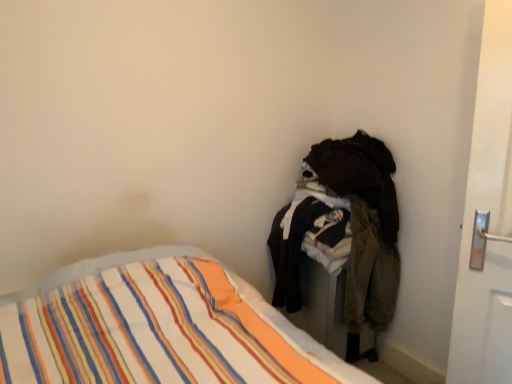
This screenshot has height=384, width=512. What are the coordinates of `striped fabric bed at lower left` in the screenshot? It's located at (300, 335).

The image size is (512, 384). What do you see at coordinates (300, 335) in the screenshot?
I see `striped fabric bed at lower left` at bounding box center [300, 335].

The height and width of the screenshot is (384, 512). I want to click on dark fabric laundry at right, so click(343, 232).

What do you see at coordinates (343, 232) in the screenshot?
I see `dark fabric laundry at right` at bounding box center [343, 232].

In order to face dark fabric laundry at right, should I rotate leftwards or rightwards?

You should rotate right by 9.569 degrees.

The width and height of the screenshot is (512, 384). Identify the location of striped fabric bed at lower left. click(300, 335).

Considering the relative positions of dark fabric laundry at right and striped fabric bed at lower left in the image provided, is dark fabric laundry at right to the left of striped fabric bed at lower left from the viewer's perspective?

No, dark fabric laundry at right is not to the left of striped fabric bed at lower left.

Considering the positions of objects dark fabric laundry at right and striped fabric bed at lower left in the image provided, who is in front, dark fabric laundry at right or striped fabric bed at lower left?

striped fabric bed at lower left.

Does point (377, 197) come closer to viewer compared to point (371, 377)?

No.

From the image's perspective, which is above, dark fabric laundry at right or striped fabric bed at lower left?

dark fabric laundry at right appears higher in the image.

From a real-world perspective, which object stands above the other?

dark fabric laundry at right is physically above.

Considering the sizes of objects dark fabric laundry at right and striped fabric bed at lower left in the image provided, who is thinner, dark fabric laundry at right or striped fabric bed at lower left?

Thinner between the two is dark fabric laundry at right.

Based on the photo, does dark fabric laundry at right have a lesser height compared to striped fabric bed at lower left?

In fact, dark fabric laundry at right may be taller than striped fabric bed at lower left.

Can you confirm if dark fabric laundry at right is smaller than striped fabric bed at lower left?

Yes, dark fabric laundry at right is smaller than striped fabric bed at lower left.

Which is correct: dark fabric laundry at right is inside striped fabric bed at lower left, or outside of it?

dark fabric laundry at right exists outside the volume of striped fabric bed at lower left.

Is dark fabric laundry at right not close to striped fabric bed at lower left?

No, dark fabric laundry at right is not far from striped fabric bed at lower left.

Is dark fabric laundry at right oriented towards striped fabric bed at lower left?

Yes, dark fabric laundry at right is aimed at striped fabric bed at lower left.

The height and width of the screenshot is (384, 512). What are the coordinates of `bed that appears below the dark fabric laundry at right (from the image's perspective)` in the screenshot? It's located at (300, 335).

Is striped fabric bed at lower left to the right of dark fabric laundry at right from the viewer's perspective?

No, striped fabric bed at lower left is not to the right of dark fabric laundry at right.

Relative to dark fabric laundry at right, is striped fabric bed at lower left in front or behind?

In the image, striped fabric bed at lower left appears in front of dark fabric laundry at right.

Consider the image. Which is farther, (357, 368) or (350, 281)?

The point (350, 281) is farther from the camera.

From the image's perspective, would you say striped fabric bed at lower left is positioned over dark fabric laundry at right?

No, from the image's perspective, striped fabric bed at lower left is not over dark fabric laundry at right.

Looking at this image, from a real-world perspective, is striped fabric bed at lower left on top of dark fabric laundry at right?

No, from a real-world perspective, striped fabric bed at lower left is not on top of dark fabric laundry at right.

Does striped fabric bed at lower left have a lesser width compared to dark fabric laundry at right?

Incorrect, the width of striped fabric bed at lower left is not less than that of dark fabric laundry at right.

Considering the sizes of striped fabric bed at lower left and dark fabric laundry at right in the image, is striped fabric bed at lower left taller or shorter than dark fabric laundry at right?

Considering their sizes, striped fabric bed at lower left has less height than dark fabric laundry at right.

Who is smaller, striped fabric bed at lower left or dark fabric laundry at right?

dark fabric laundry at right is smaller.

Is striped fabric bed at lower left not within dark fabric laundry at right?

striped fabric bed at lower left is positioned outside dark fabric laundry at right.

Does striped fabric bed at lower left touch dark fabric laundry at right?

No, striped fabric bed at lower left is not beside dark fabric laundry at right.

Is striped fabric bed at lower left facing away from dark fabric laundry at right?

No, dark fabric laundry at right is not at the back of striped fabric bed at lower left.

How distant is striped fabric bed at lower left from dark fabric laundry at right?

The distance of striped fabric bed at lower left from dark fabric laundry at right is 27.86 inches.

I want to click on laundry lying on the right of striped fabric bed at lower left, so click(x=343, y=232).

Where is `laundry that is behind the striped fabric bed at lower left`? The height and width of the screenshot is (384, 512). laundry that is behind the striped fabric bed at lower left is located at coordinates (343, 232).

You are a GUI agent. You are given a task and a screenshot of the screen. Output one action in this format:
    pyautogui.click(x=<x>, y=<y>)
    Task: Click on the bed on the left of dark fabric laundry at right
    This screenshot has height=384, width=512.
    Given the screenshot: What is the action you would take?
    (x=300, y=335)